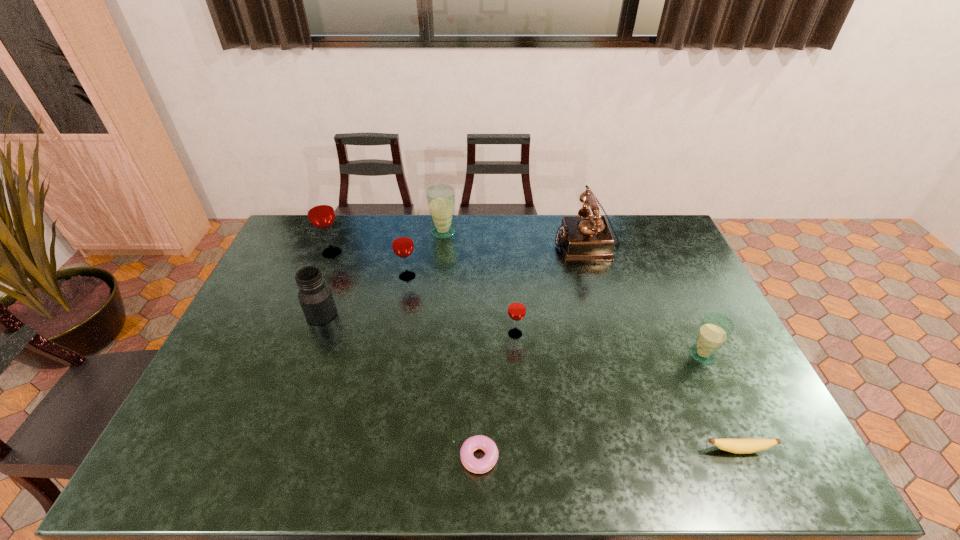
I want to click on doughnut that is at the near edge, so click(x=483, y=465).

Identify the location of object located in the left edge section of the desktop. This screenshot has width=960, height=540. (320, 211).

Where is `glass that is at the right edge`? The width and height of the screenshot is (960, 540). glass that is at the right edge is located at coordinates (715, 329).

The height and width of the screenshot is (540, 960). Find the location of `banana positioned at the right edge`. banana positioned at the right edge is located at coordinates (738, 446).

Identify the location of object that is positioned at the far left corner. Image resolution: width=960 pixels, height=540 pixels. (320, 211).

This screenshot has width=960, height=540. What are the coordinates of `object that is at the near right corner` in the screenshot? It's located at (738, 446).

In the image, there is a desktop. At what (x,y) coordinates should I click in order to perform the action: click on vacant space at the far edge. Please return your answer as a coordinate pair (x, y). The width and height of the screenshot is (960, 540). Looking at the image, I should click on (347, 239).

The width and height of the screenshot is (960, 540). What are the coordinates of `vacant region at the near edge` in the screenshot? It's located at (298, 451).

In order to click on free space at the left edge in this screenshot , I will do `click(282, 333)`.

Locate an element on the screen. free location at the right edge is located at coordinates (698, 376).